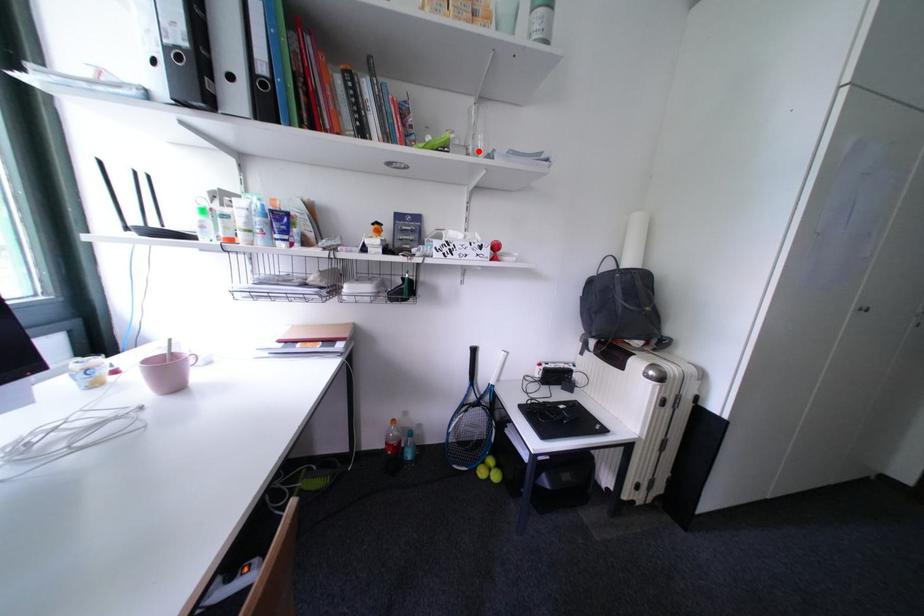
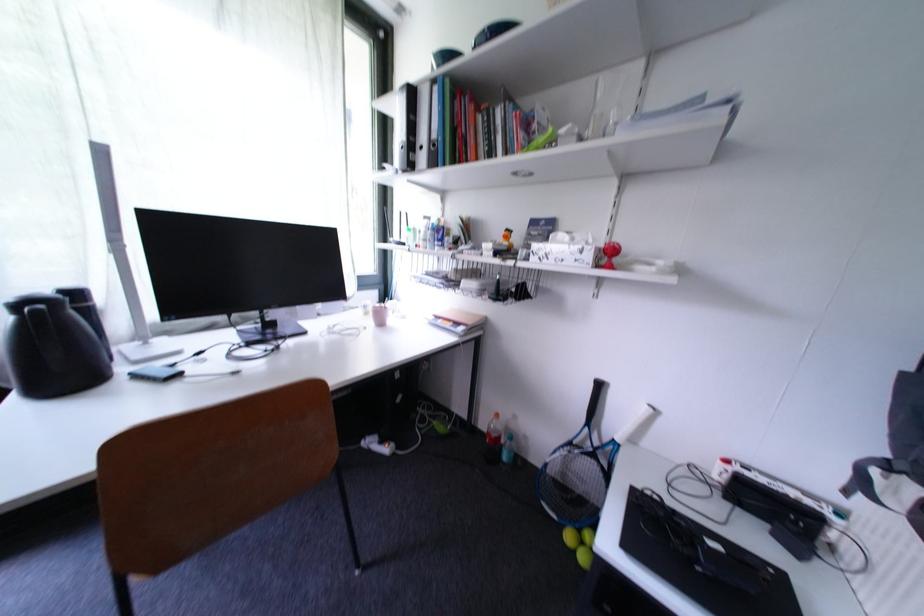
The point at the highlighted location is marked in the first image. Where is the corresponding point in the second image?

(594, 136)